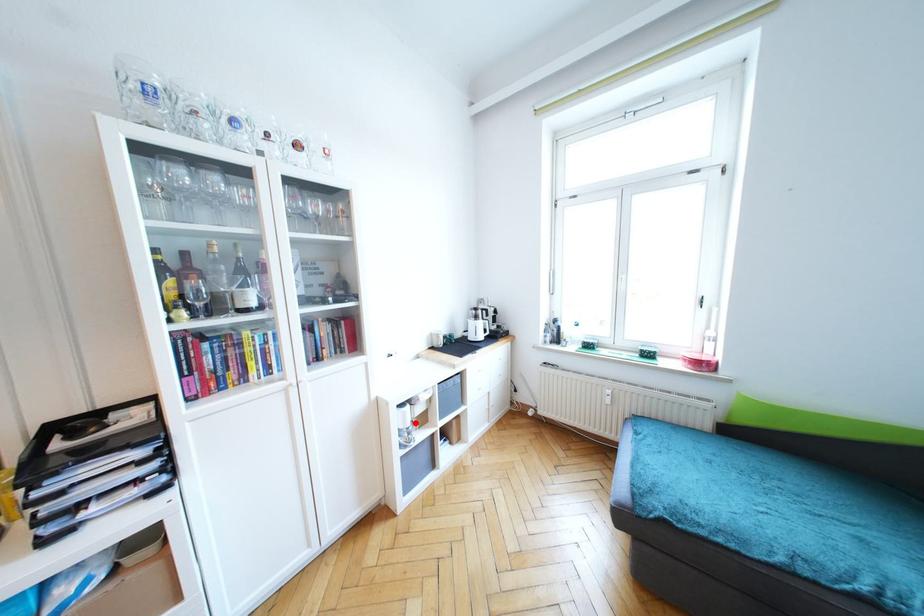
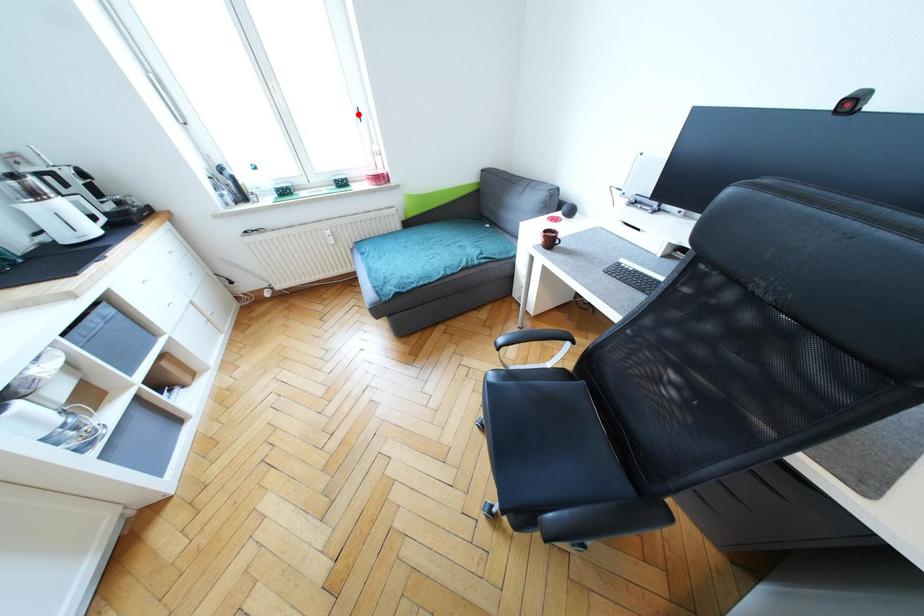
I am providing you with two images of the same scene from different viewpoints. A red point is marked on the first image and another point is marked on the second image. Is the marked point in image1 the same physical position as the marked point in image2?

No